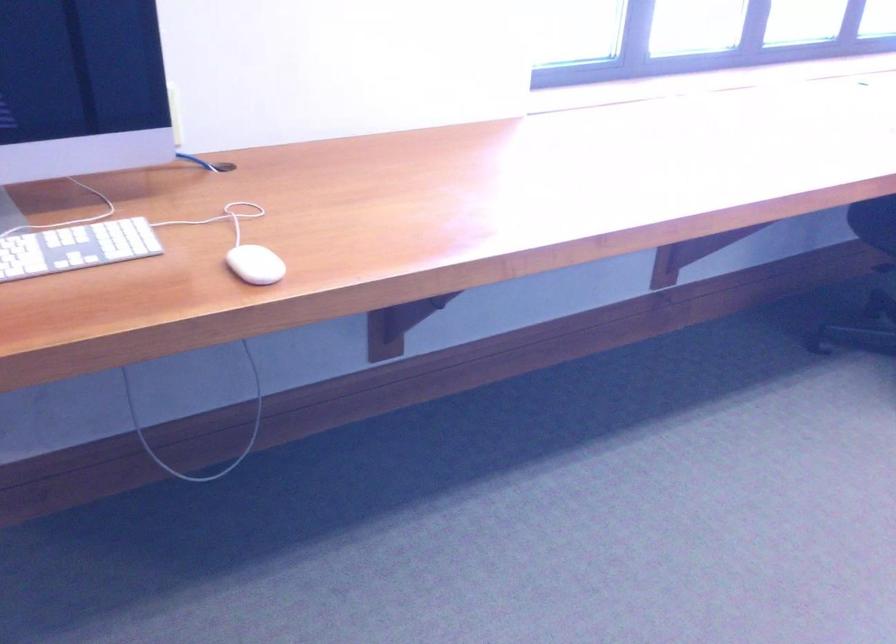
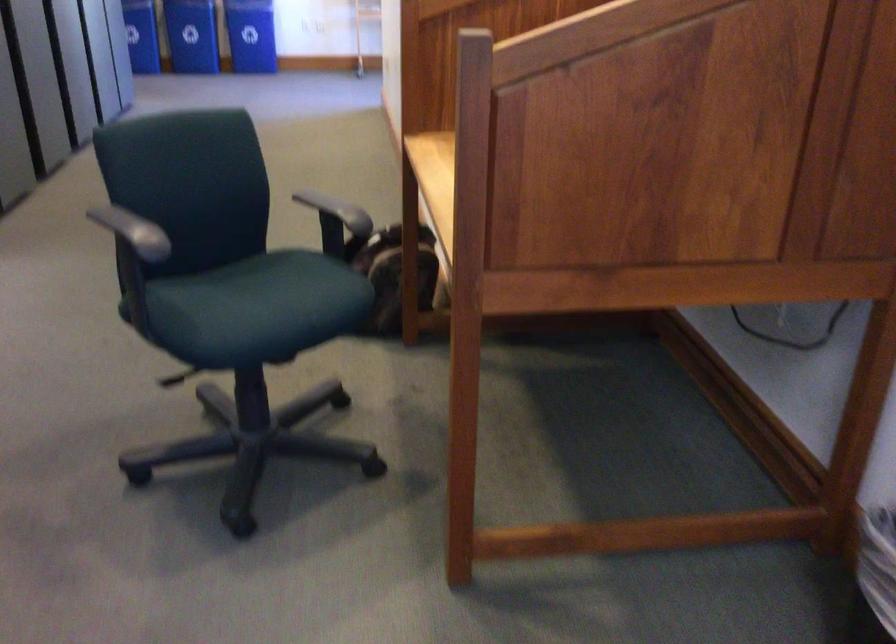
The images are taken continuously from a first-person perspective. In which direction is your viewpoint rotating?

The rotation direction of the camera is left-down.